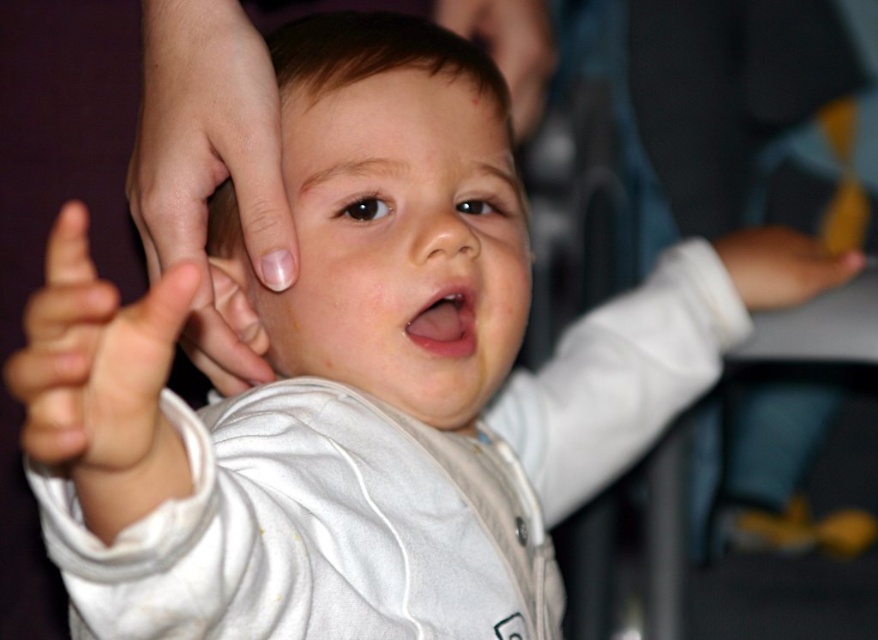
Who is more forward, (x=149, y=20) or (x=846, y=253)?

Point (x=149, y=20)

Does point (162, 61) come in front of point (727, 262)?

Yes, point (162, 61) is in front of point (727, 262).

The width and height of the screenshot is (878, 640). I want to click on smooth skin hand at center, so [210, 170].

Between white soft hand at left and smooth skin hand at upper right, which one appears on the left side from the viewer's perspective?

white soft hand at left

The image size is (878, 640). In order to click on white soft hand at left in this screenshot , I will do `click(98, 365)`.

Which of these two, smooth skin hand at center or white soft hand at left, stands shorter?

With less height is white soft hand at left.

Is smooth skin hand at center smaller than white soft hand at left?

No.

Image resolution: width=878 pixels, height=640 pixels. In order to click on smooth skin hand at center in this screenshot , I will do `click(210, 170)`.

Locate an element on the screen. smooth skin hand at center is located at coordinates (210, 170).